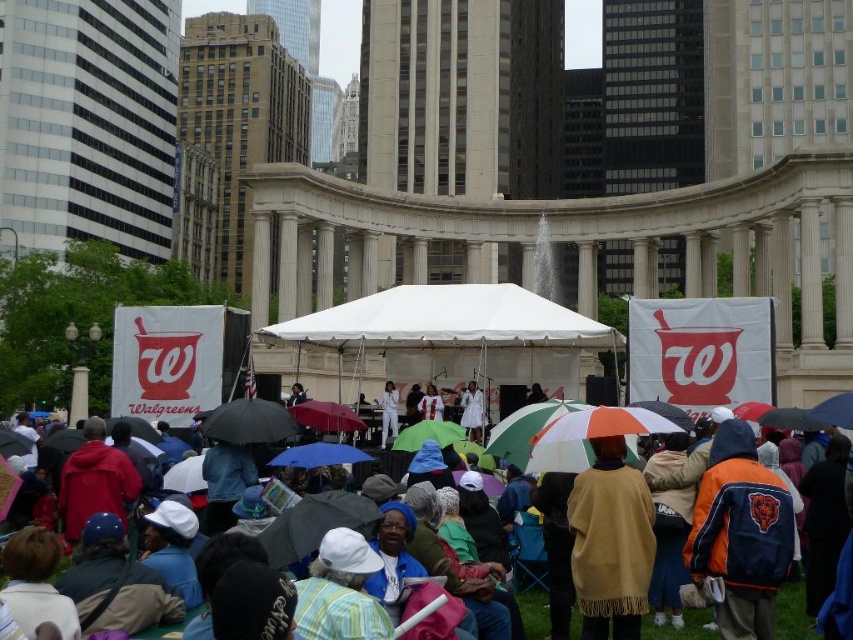
From the picture: You are standing in the public square and want to reach the green matte umbrella at center without getting wet. The orange fabric jacket at lower right is blocking your path. Can you walk around it? Explain your reasoning.

The orange fabric jacket at lower right is closer to the viewer than the green matte umbrella at center, meaning the jacket is in front of the umbrella. Since the jacket is blocking your path, you can walk around it either to the left or right to reach the umbrella without obstruction.

In the scene shown: You are standing in the public square and want to walk from point A to point B. Point A is at coordinate point (169, 627) and point B is at coordinate point (410, 445). Which point is closer to you when you start walking?

Point A at coordinate point (169, 627) is closer to you than point B at coordinate point (410, 445), so you will start closer to point A.